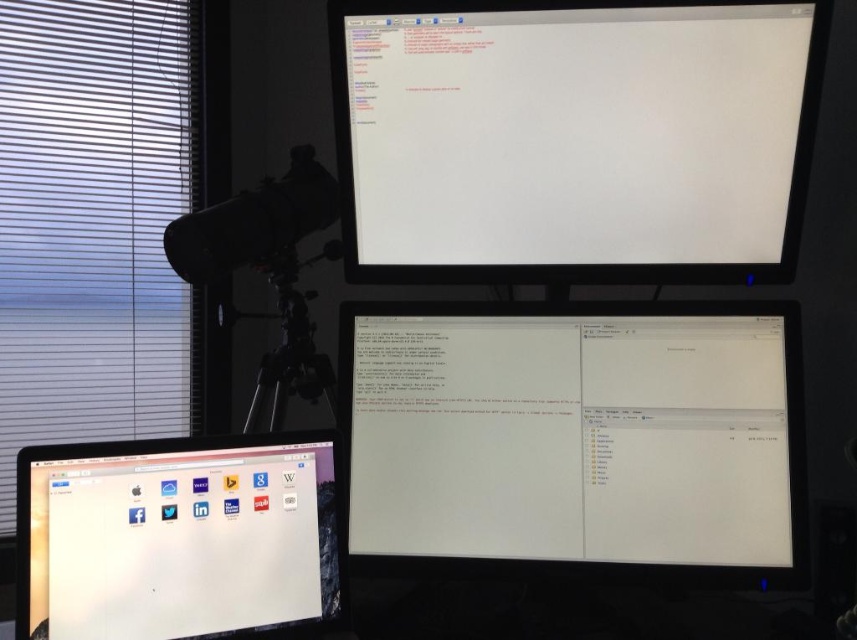
You are setting up a new webcam for a live stream. The webcam has a minimum focus distance of 16 inches. You have the matte black monitor at lower left and the black matte tripod at center in your view. Can the webcam focus on both objects simultaneously?

The matte black monitor at lower left and the black matte tripod at center are 18.21 inches apart from each other. Since the minimum focus distance is 16 inches, the webcam can focus on both objects simultaneously as the distance between them meets the requirement.

You are setting up a new monitor stand and want to ensure it can accommodate both the white glossy monitor at upper center and the white matte blinds at left. Which object has a greater width to determine the required stand size?

The white glossy monitor at upper center is wider than the white matte blinds at left, so the stand must be sized to accommodate the white glossy monitor at upper center.